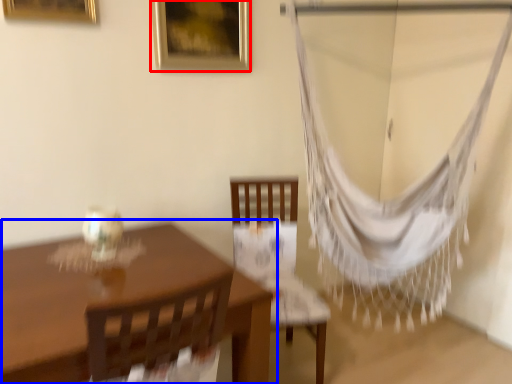
Question: Which of the following is the closest to the observer, picture frame (highlighted by a red box) or table (highlighted by a blue box)?

Choices:
 (A) picture frame
 (B) table

Answer: (B)